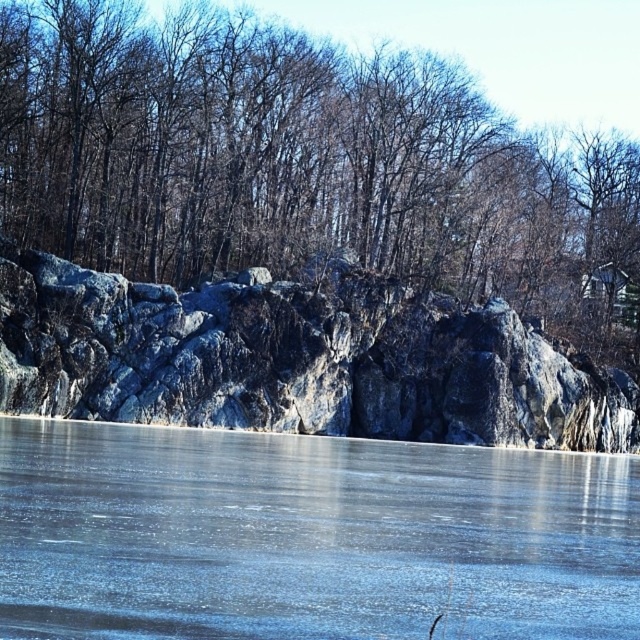
From the picture: You are an artist planning to paint this winter scene. You want to ensure the dark brown bark tree at upper center and the granite rock formation at center are proportionally accurate. Based on the scene, which object should you depict as wider?

The dark brown bark tree at upper center should be depicted as wider than the granite rock formation at center since the description states it might be wider.

You are standing at the frozen lake and see two points marked on the ice. The first point is at coordinate point (161, 636) and the second is at point (339, 346). Which point is closer to you?

Point (161, 636) is closer to the viewer than point (339, 346).